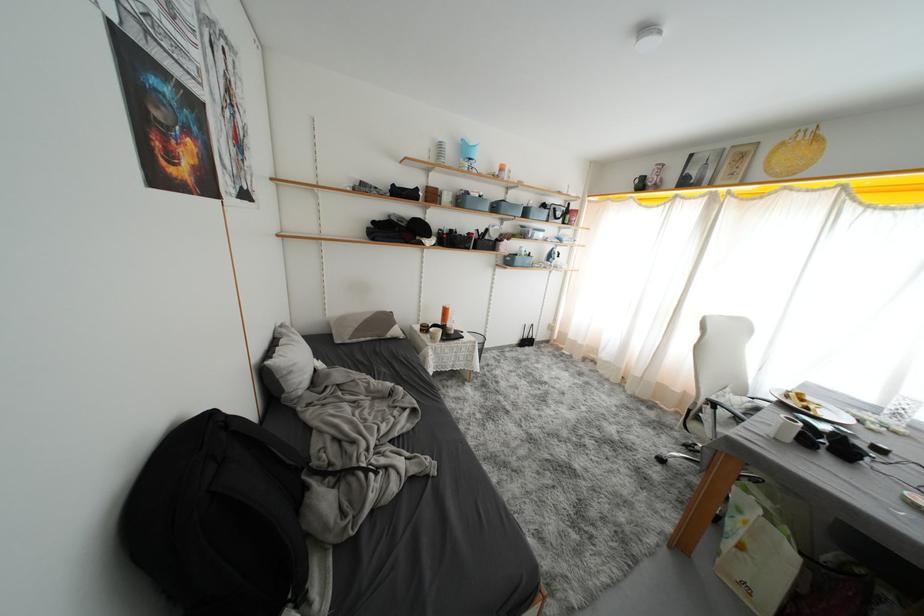
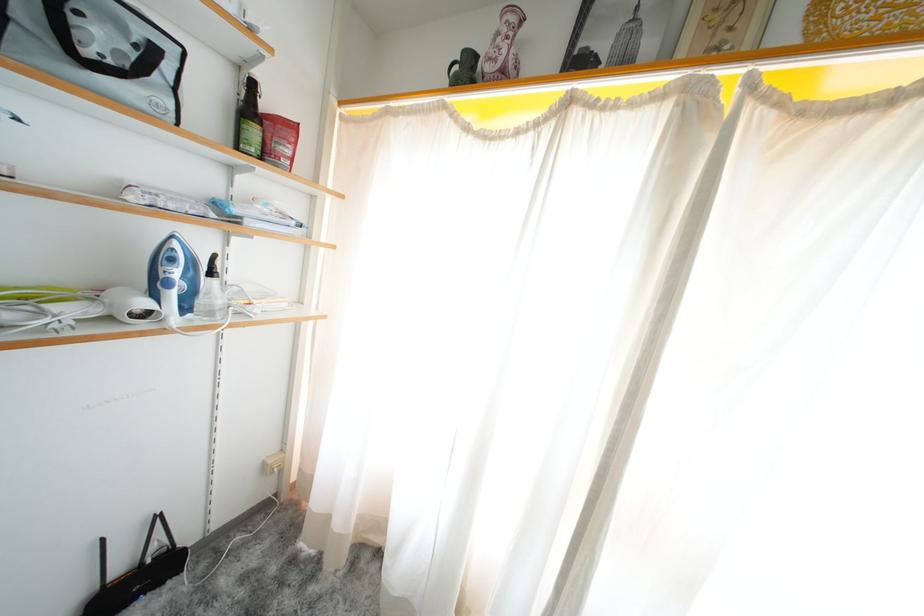
Find the pixel in the second image that matches [532,346] in the first image.

(143, 586)